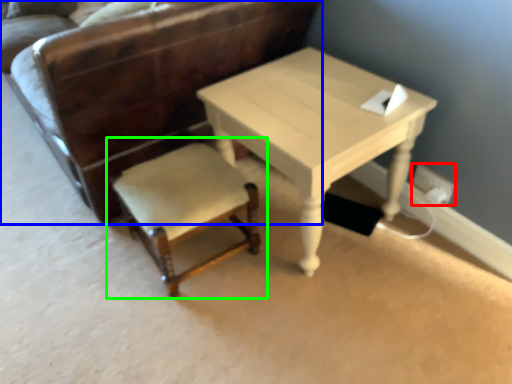
Question: Estimate the real-world distances between objects in this image. Which object is farther from electric outlet (highlighted by a red box), chair (highlighted by a blue box) or chair (highlighted by a green box)?

Choices:
 (A) chair
 (B) chair

Answer: (A)